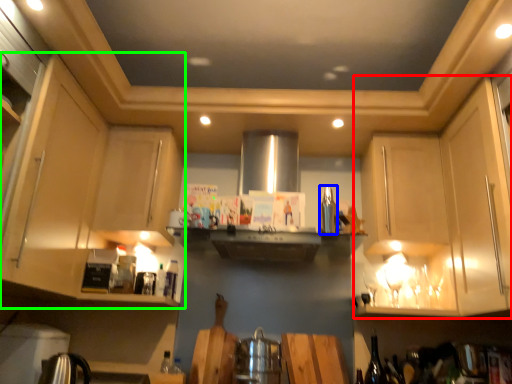
Question: Which object is the farthest from cabinetry (highlighted by a red box)? Choose among these: appliance (highlighted by a blue box) or cabinetry (highlighted by a green box).

Choices:
 (A) appliance
 (B) cabinetry

Answer: (B)